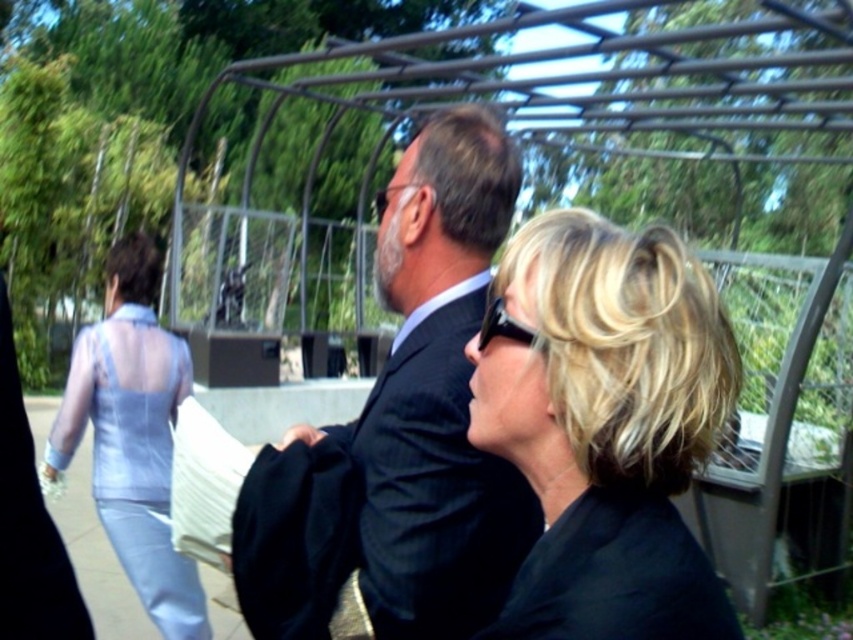
Which is below, blonde hair at center or light blue sheer dress at left?

light blue sheer dress at left is below.

In order to click on blonde hair at center in this screenshot , I will do `click(605, 426)`.

Where is `blonde hair at center`? This screenshot has width=853, height=640. blonde hair at center is located at coordinates (605, 426).

Is blonde hair at center positioned in front of dark gray suit at center?

Yes, blonde hair at center is in front of dark gray suit at center.

Between blonde hair at center and dark gray suit at center, which one has more height?

dark gray suit at center

Is point (664, 490) farther from viewer compared to point (405, 550)?

No, it is in front of (405, 550).

In order to click on blonde hair at center in this screenshot , I will do `click(605, 426)`.

Can you confirm if dark gray suit at center is smaller than light blue sheer dress at left?

Yes.

Which is in front, point (415, 620) or point (107, 509)?

Point (415, 620) is in front.

Between point (474, 230) and point (129, 413), which one is positioned in front?

Positioned in front is point (474, 230).

At what (x,y) coordinates should I click in order to perform the action: click on dark gray suit at center. Please return your answer as a coordinate pair (x, y). The image size is (853, 640). Looking at the image, I should click on (403, 428).